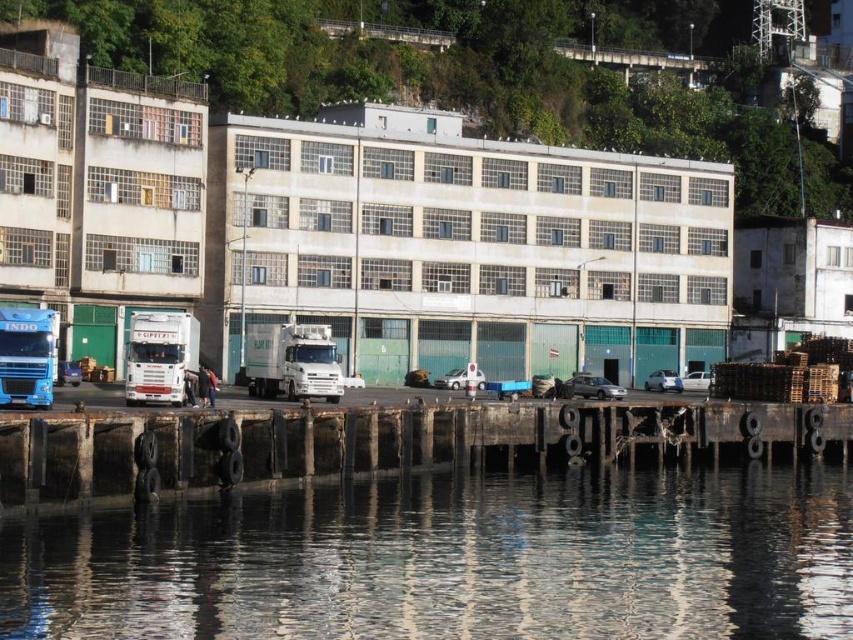
Question: Considering the real-world distances, which object is closest to the rusty wooden dock at lower center?

Choices:
 (A) white glossy truck at center
 (B) blue metallic truck at left
 (C) transparent water at lower center
 (D) white matte truck at left

Answer: (C)

Question: Does white glossy truck at center appear on the left side of white matte truck at left?

Choices:
 (A) yes
 (B) no

Answer: (B)

Question: Is transparent water at lower center below blue metallic truck at left?

Choices:
 (A) no
 (B) yes

Answer: (B)

Question: Is rusty wooden dock at lower center positioned behind white matte truck at left?

Choices:
 (A) no
 (B) yes

Answer: (A)

Question: Based on their relative distances, which object is nearer to the blue metallic truck at left?

Choices:
 (A) rusty wooden dock at lower center
 (B) transparent water at lower center
 (C) white glossy truck at center
 (D) white matte truck at left

Answer: (D)

Question: Among these objects, which one is nearest to the camera?

Choices:
 (A) white matte truck at left
 (B) rusty wooden dock at lower center
 (C) white glossy truck at center
 (D) blue metallic truck at left

Answer: (B)